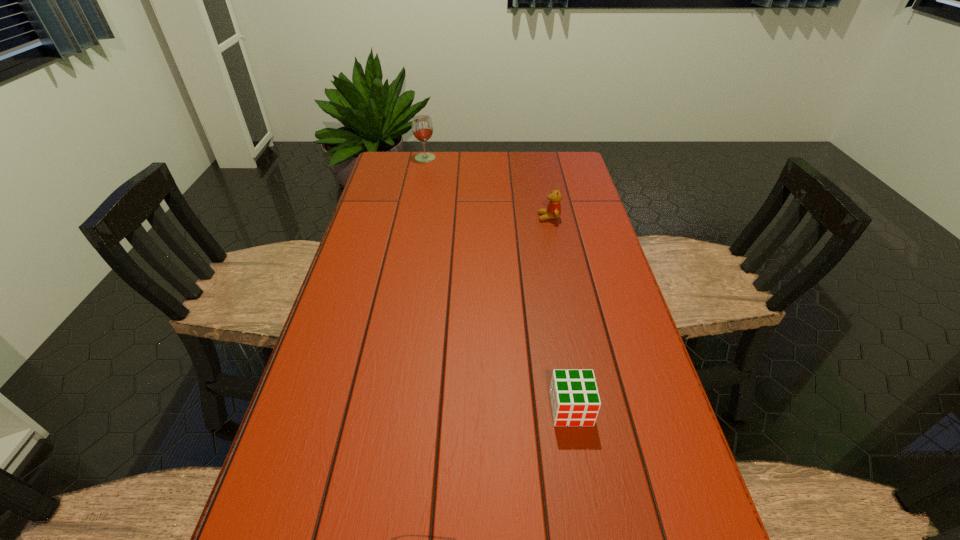
Locate an element on the screen. blank area located on the red face of the cube is located at coordinates (583, 477).

Identify the location of object at the far edge. (422, 128).

In order to click on object located in the left edge section of the desktop in this screenshot , I will do `click(422, 128)`.

The width and height of the screenshot is (960, 540). In order to click on teddy bear that is at the right edge in this screenshot , I will do `click(553, 211)`.

I want to click on cube that is at the right edge, so click(575, 401).

Identify the location of object situated at the far left corner. This screenshot has width=960, height=540. (422, 128).

The height and width of the screenshot is (540, 960). In the image, there is a desktop. Identify the location of vacant region at the far edge. (475, 152).

I want to click on vacant space at the left edge, so click(x=392, y=201).

This screenshot has height=540, width=960. I want to click on free space at the right edge of the desktop, so click(x=647, y=538).

This screenshot has height=540, width=960. I want to click on blank area at the far left corner, so click(x=391, y=166).